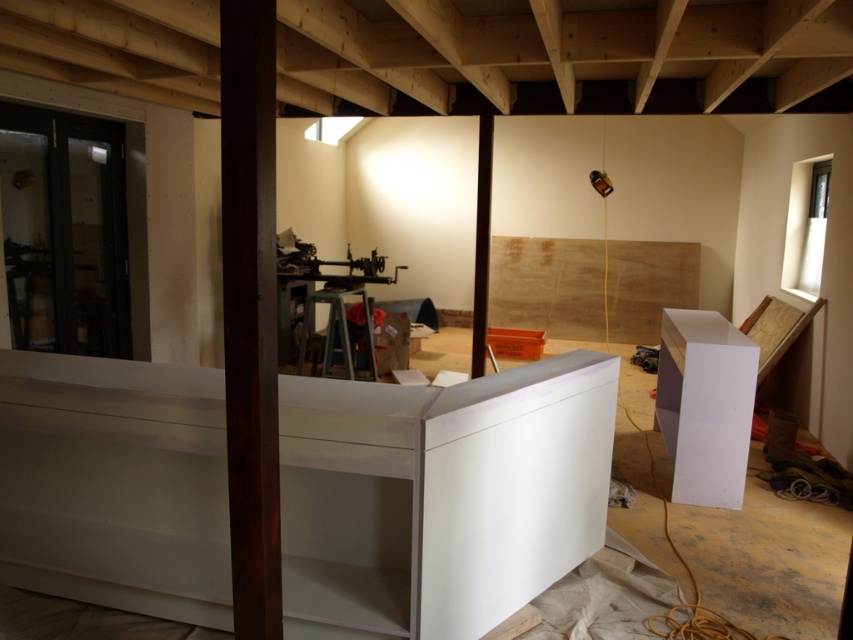
Who is more distant from viewer, (721, 360) or (473, 294)?

The point (473, 294) is more distant.

Who is taller, white glossy cabinet at right or matte black beam at center?

matte black beam at center is taller.

Who is more distant from viewer, [677,342] or [474,282]?

The point [474,282] is behind.

Locate an element on the screen. The image size is (853, 640). white glossy cabinet at right is located at coordinates tap(705, 404).

Between dark wood pillar at center and matte black beam at center, which one has less height?

With less height is dark wood pillar at center.

Measure the distance between dark wood pillar at center and camera.

dark wood pillar at center is 1.68 meters from camera.

Find the location of `dark wood pillar at center`. dark wood pillar at center is located at coordinates (250, 312).

Is point (260, 576) positioned behind point (683, 356)?

No.

Is dark wood pillar at center thinner than white glossy cabinet at right?

Correct, dark wood pillar at center's width is less than white glossy cabinet at right's.

Which is behind, point (245, 144) or point (724, 476)?

Point (724, 476)

This screenshot has height=640, width=853. In order to click on dark wood pillar at center in this screenshot , I will do `click(250, 312)`.